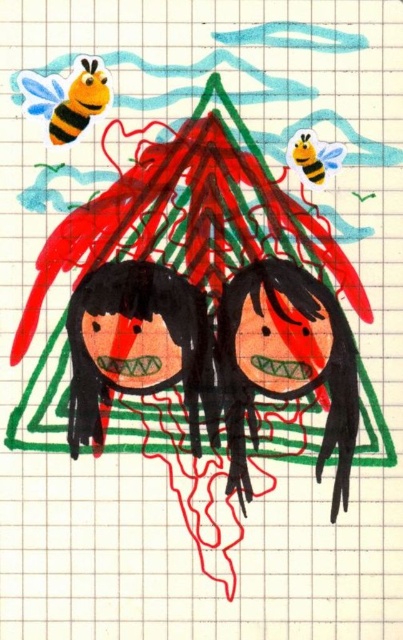
You are looking at the child drawing and want to place a sticker on the closest object to you between the black matte doll at center and the yellow striped bee at upper left. Which object should you choose?

The black matte doll at center is closer to you than the yellow striped bee at upper left, so you should place the sticker on the black matte doll at center.

You are a parent looking at your child drawing. You see a black matte doll at center and a yellow striped bee at upper left. Which object in the drawing is taller?

The black matte doll at center is taller than the yellow striped bee at upper left.

You are a toy collector who wants to display both the black matte doll at center and the smooth black doll at center on a shelf. Since the shelf has limited space, which doll should you place first to ensure both fit properly?

The black matte doll at center is larger than the smooth black doll at center, so you should place the black matte doll at center first to ensure both fit on the shelf.